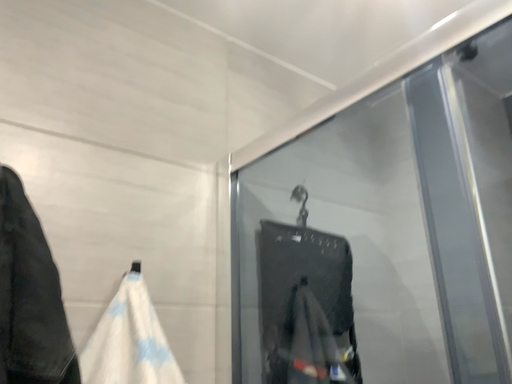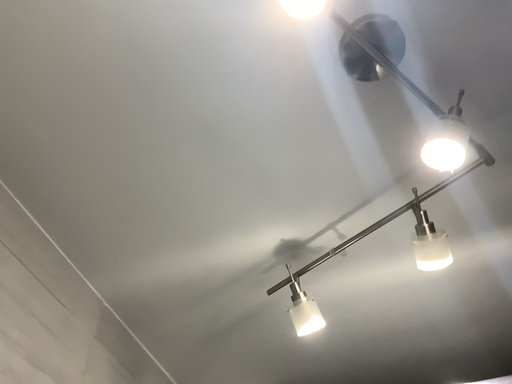
Question: Which way did the camera rotate in the video?

Choices:
 (A) rotated downward
 (B) rotated upward

Answer: (B)